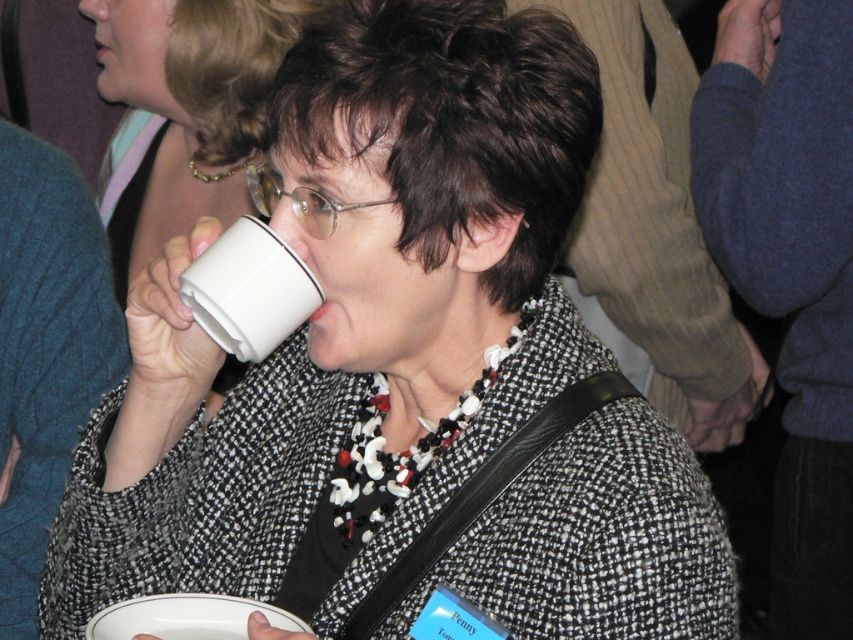
You are standing at point (244, 266) and want to walk to point (170, 61). Which direction should you move in to reach your destination?

To reach point (170, 61) from point (244, 266), you should move backward since point (170, 61) is behind point (244, 266) relative to your current position.

You are at a social event and need to grab a drink quickly. There are two cups in front of you, the white matte cup at upper center and the white ceramic mug at upper center. If you want to reach the one closer to you, which one should you choose?

The white matte cup at upper center is closer to you than the white ceramic mug at upper center, so you should choose the white matte cup at upper center.